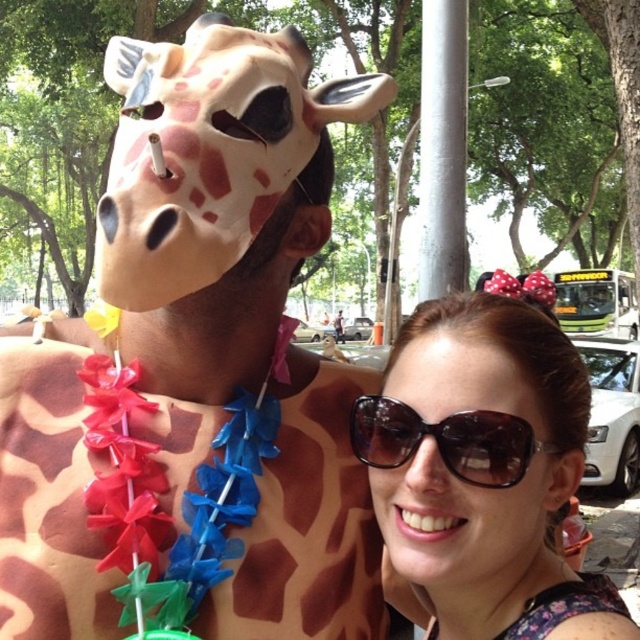
You are a photographer trying to capture a closeup of the brown matte sunglasses at center. However, the brown matte giraffe mask at upper left is blocking your view. Can you estimate if the mask is bigger than the sunglasses?

The brown matte giraffe mask at upper left is larger in size than the brown matte sunglasses at center, so yes, the mask is blocking the view because it is bigger.

You are standing in front of the two people in the photo. You want to hand a small gift to the person wearing the brown matte giraffe mask at upper left without moving closer. Can you reach them from your current position? The average human arm length is about 25 inches.

The brown matte giraffe mask at upper left and viewer are 26.90 inches apart. Since the average human arm length is about 25 inches, you cannot reach the person wearing the brown matte giraffe mask at upper left from your current position.